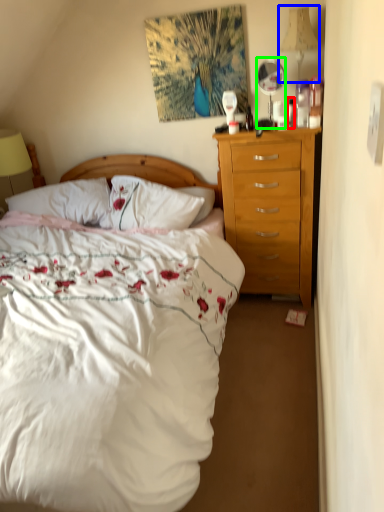
Question: Based on their relative distances, which object is nearer to bottle (highlighted by a red box)? Choose from lamp (highlighted by a blue box) and mirror (highlighted by a green box).

Choices:
 (A) lamp
 (B) mirror

Answer: (B)